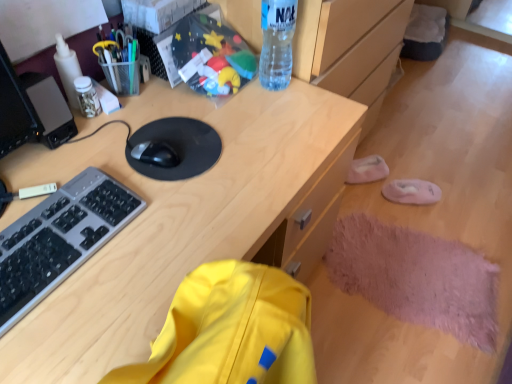
Where is `free space that is in between gray plastic keyboard at left and metallic pen holder at upper left, positioned as the first stationery in right-to-left order`? Image resolution: width=512 pixels, height=384 pixels. free space that is in between gray plastic keyboard at left and metallic pen holder at upper left, positioned as the first stationery in right-to-left order is located at coordinates click(x=99, y=147).